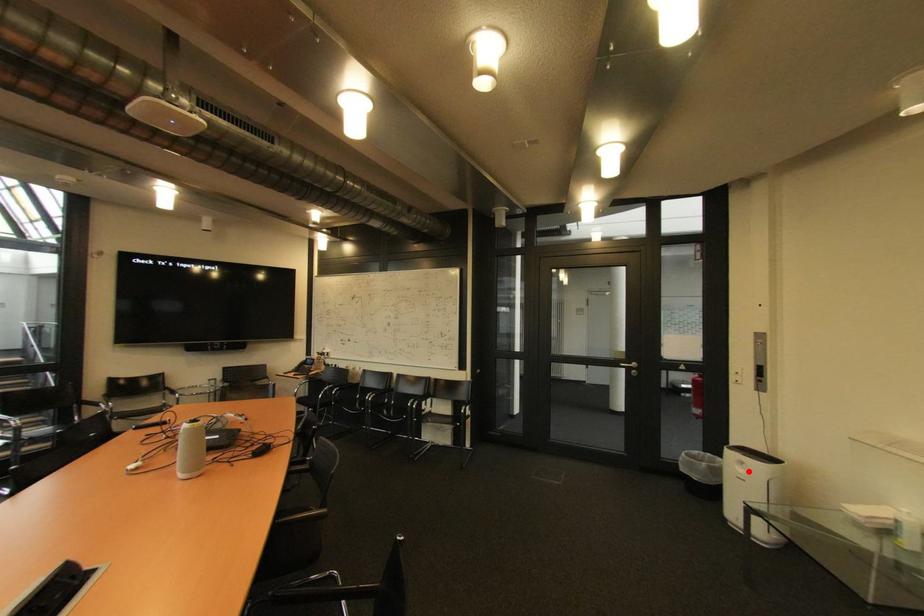
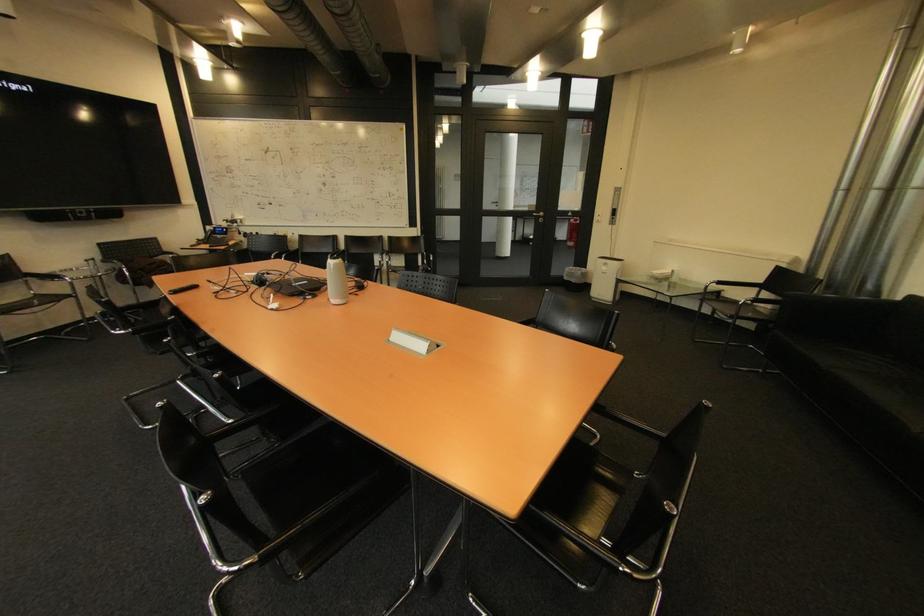
The point at the highlighted location is marked in the first image. Where is the corresponding point in the second image?

(613, 270)